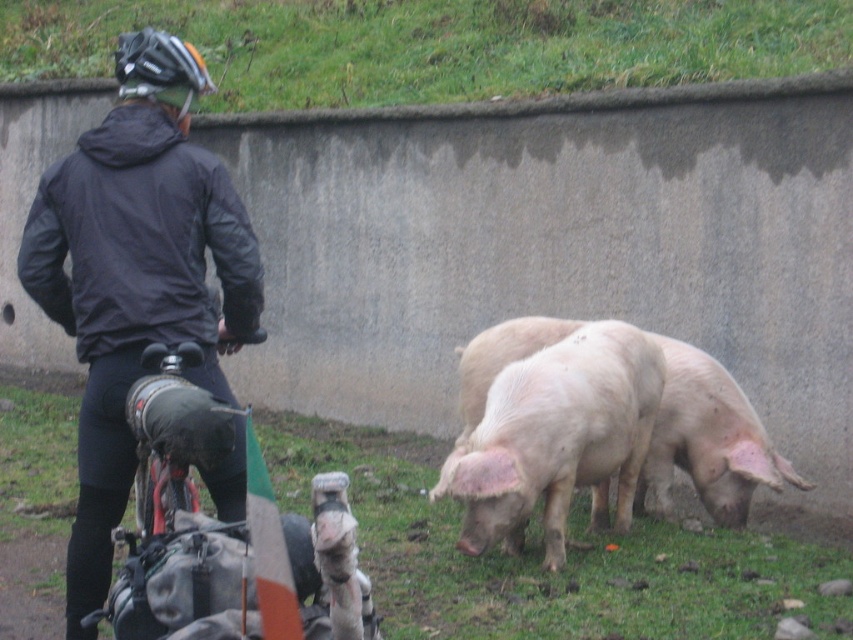
Question: Among these points, which one is nearest to the camera?

Choices:
 (A) (602, 516)
 (B) (596, 8)

Answer: (A)

Question: Can you confirm if green grass at lower center is positioned above green grass at upper center?

Choices:
 (A) yes
 (B) no

Answer: (B)

Question: Can you confirm if green grass at lower center is positioned below matte black jacket at left?

Choices:
 (A) yes
 (B) no

Answer: (A)

Question: Based on their relative distances, which object is nearer to the green grass at lower center?

Choices:
 (A) green grass at upper center
 (B) matte black jacket at left
 (C) matte black helmet at upper left
 (D) pink smooth pig at center

Answer: (D)

Question: Is matte black jacket at left bigger than pink smooth pig at center?

Choices:
 (A) no
 (B) yes

Answer: (A)

Question: Which object is farther from the camera taking this photo?

Choices:
 (A) pink smooth pig at center
 (B) pink smooth skin at center

Answer: (B)